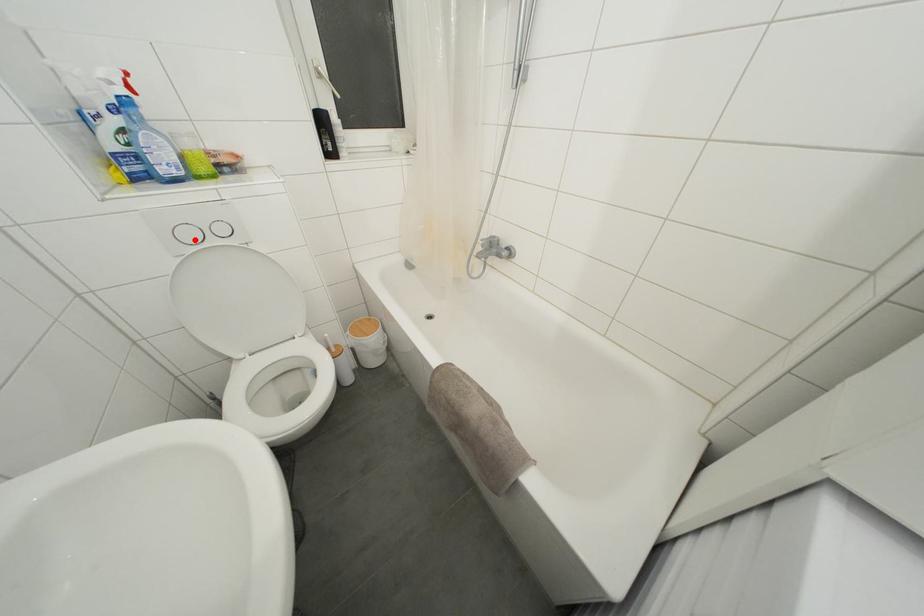
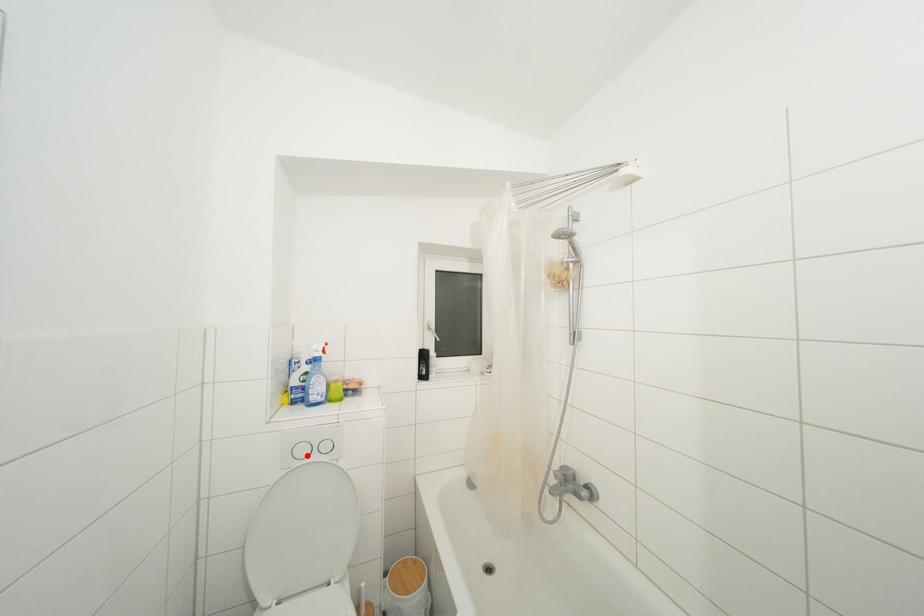
I am providing you with two images of the same scene from different viewpoints. A red point is marked on the first image and another point is marked on the second image. Does the point marked in image1 correspond to the same location as the one in image2?

Yes